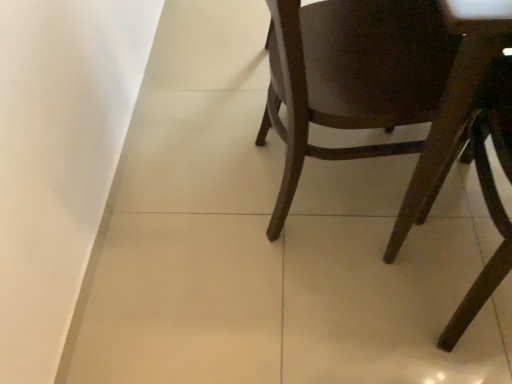
Question: Should I look upward or downward to see dark wood chair at right, acting as the second chair starting from the right?

Choices:
 (A) down
 (B) up

Answer: (B)

Question: Is dark wood chair at lower right, the 1th chair viewed from the right, inside dark wood chair at right, which is the first chair in left-to-right order?

Choices:
 (A) yes
 (B) no

Answer: (B)

Question: Is dark wood chair at right, which is the first chair in left-to-right order, wider than dark wood chair at lower right, the 2th chair in the left-to-right sequence?

Choices:
 (A) yes
 (B) no

Answer: (A)

Question: Can you confirm if dark wood chair at right, which is the first chair in left-to-right order, is positioned to the right of dark wood chair at lower right, the 1th chair viewed from the right?

Choices:
 (A) yes
 (B) no

Answer: (B)

Question: Does dark wood chair at right, which is the first chair in left-to-right order, turn towards dark wood chair at lower right, the 1th chair viewed from the right?

Choices:
 (A) no
 (B) yes

Answer: (A)

Question: From a real-world perspective, is dark wood chair at right, which is the first chair in left-to-right order, physically below dark wood chair at lower right, the 2th chair in the left-to-right sequence?

Choices:
 (A) no
 (B) yes

Answer: (A)

Question: Is dark wood chair at lower right, the 2th chair in the left-to-right sequence, aimed at dark wood chair at right, which is the first chair in left-to-right order?

Choices:
 (A) yes
 (B) no

Answer: (B)

Question: Is dark wood chair at lower right, the 1th chair viewed from the right, at the right side of dark wood chair at right, which is the first chair in left-to-right order?

Choices:
 (A) no
 (B) yes

Answer: (B)

Question: Would you consider dark wood chair at lower right, the 2th chair in the left-to-right sequence, to be distant from dark wood chair at right, which is the first chair in left-to-right order?

Choices:
 (A) yes
 (B) no

Answer: (B)

Question: Is dark wood chair at lower right, the 1th chair viewed from the right, positioned in front of dark wood chair at right, acting as the second chair starting from the right?

Choices:
 (A) yes
 (B) no

Answer: (A)

Question: Are dark wood chair at lower right, the 1th chair viewed from the right, and dark wood chair at right, acting as the second chair starting from the right, beside each other?

Choices:
 (A) no
 (B) yes

Answer: (A)

Question: From the image's perspective, is dark wood chair at lower right, the 1th chair viewed from the right, below dark wood chair at right, which is the first chair in left-to-right order?

Choices:
 (A) no
 (B) yes

Answer: (B)

Question: Looking at the image, does dark wood chair at lower right, the 1th chair viewed from the right, seem bigger or smaller compared to dark wood chair at right, acting as the second chair starting from the right?

Choices:
 (A) small
 (B) big

Answer: (A)